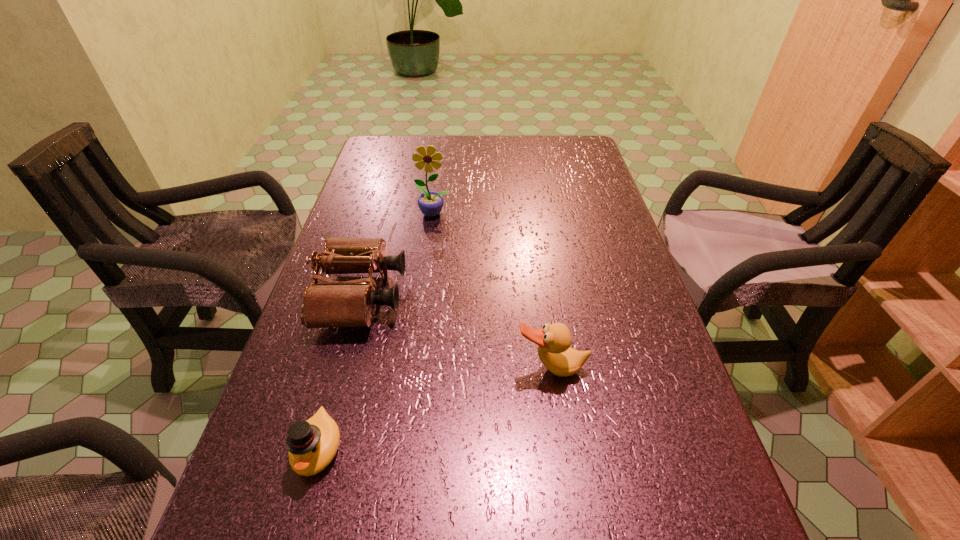
At what (x,y) coordinates should I click in order to perform the action: click on vacant region between the second farthest object and the shorter duck. Please return your answer as a coordinate pair (x, y). The height and width of the screenshot is (540, 960). Looking at the image, I should click on (340, 373).

Locate an element on the screen. The height and width of the screenshot is (540, 960). unoccupied position between the second farthest object and the right duck is located at coordinates (456, 332).

At what (x,y) coordinates should I click in order to perform the action: click on vacant space that's between the binoculars and the nearest object. Please return your answer as a coordinate pair (x, y). Looking at the image, I should click on (340, 373).

Locate an element on the screen. The image size is (960, 540). vacant area that lies between the second nearest object and the nearest object is located at coordinates (435, 409).

Where is `free space between the binoculars and the farther duck`? free space between the binoculars and the farther duck is located at coordinates (456, 332).

You are a GUI agent. You are given a task and a screenshot of the screen. Output one action in this format:
    pyautogui.click(x=<x>, y=<y>)
    Task: Click on the vacant space that is in between the sunflower and the shorter duck
    Image resolution: width=960 pixels, height=540 pixels.
    Given the screenshot: What is the action you would take?
    pyautogui.click(x=376, y=332)

Find the location of a particular element. The image size is (960, 540). free area in between the sunflower and the binoculars is located at coordinates (397, 255).

What are the coordinates of `free spot between the shorter duck and the binoculars` in the screenshot? It's located at (340, 373).

Select which object appears as the second closest to the second farthest object. Please provide its 2D coordinates. Your answer should be formatted as a tuple, i.e. [(x, y)], where the tuple contains the x and y coordinates of a point satisfying the conditions above.

[(312, 444)]

Locate which object ranks second in proximity to the taller duck. Please provide its 2D coordinates. Your answer should be formatted as a tuple, i.e. [(x, y)], where the tuple contains the x and y coordinates of a point satisfying the conditions above.

[(312, 444)]